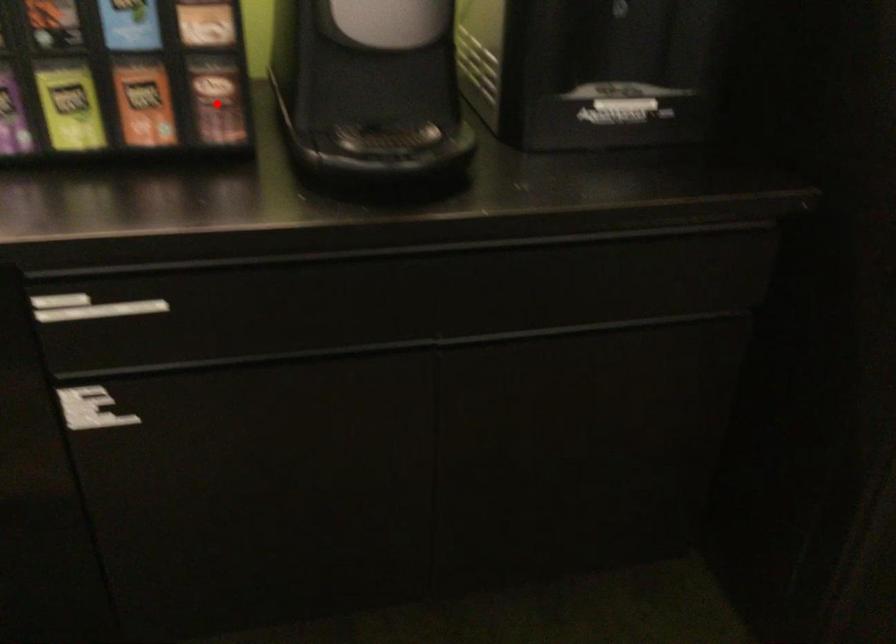
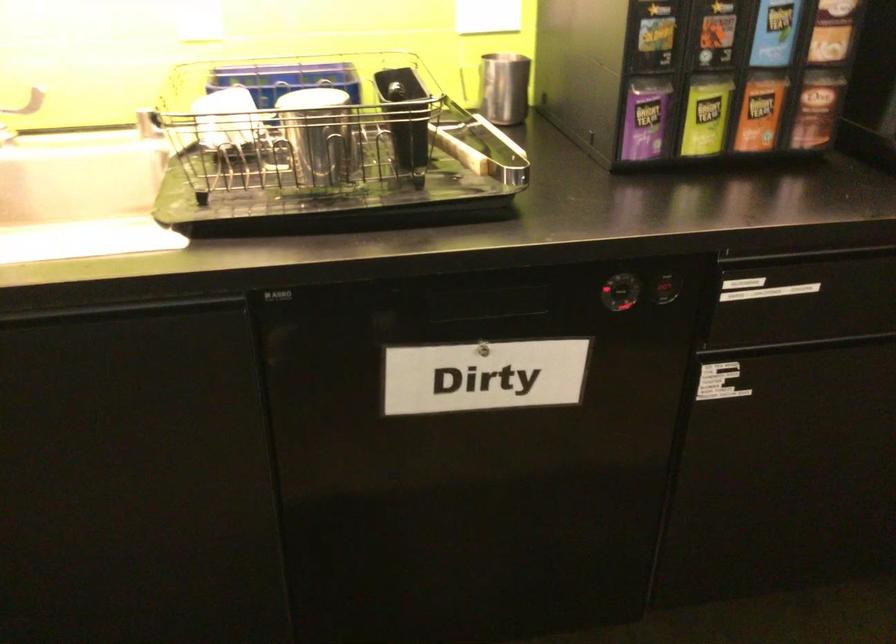
In the second image, find the point that corresponds to the highlighted location in the first image.

(816, 109)